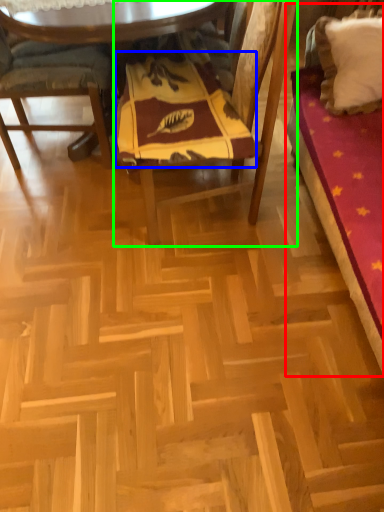
Question: Which is farther away from bed (highlighted by a red box)? blanket (highlighted by a blue box) or chair (highlighted by a green box)?

Choices:
 (A) blanket
 (B) chair

Answer: (A)